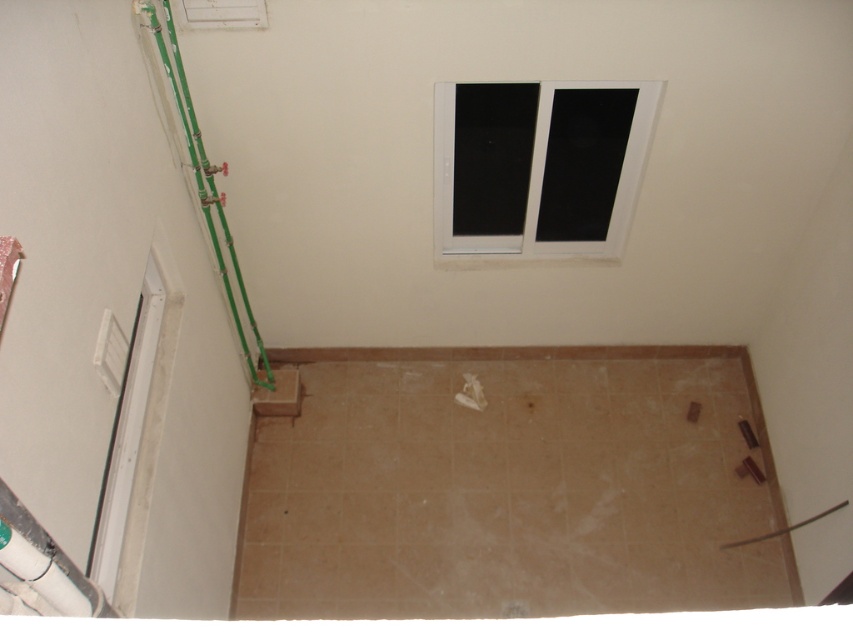
Question: Which point is closer to the camera taking this photo?

Choices:
 (A) (215, 256)
 (B) (605, 160)

Answer: (B)

Question: Does white plastic window at upper center come behind green plastic pipes at left?

Choices:
 (A) yes
 (B) no

Answer: (A)

Question: Can you confirm if white plastic window at upper center is thinner than green plastic pipes at left?

Choices:
 (A) no
 (B) yes

Answer: (A)

Question: Which point is closer to the camera taking this photo?

Choices:
 (A) (630, 109)
 (B) (231, 305)

Answer: (A)

Question: Does white plastic window at upper center have a larger size compared to green plastic pipes at left?

Choices:
 (A) no
 (B) yes

Answer: (B)